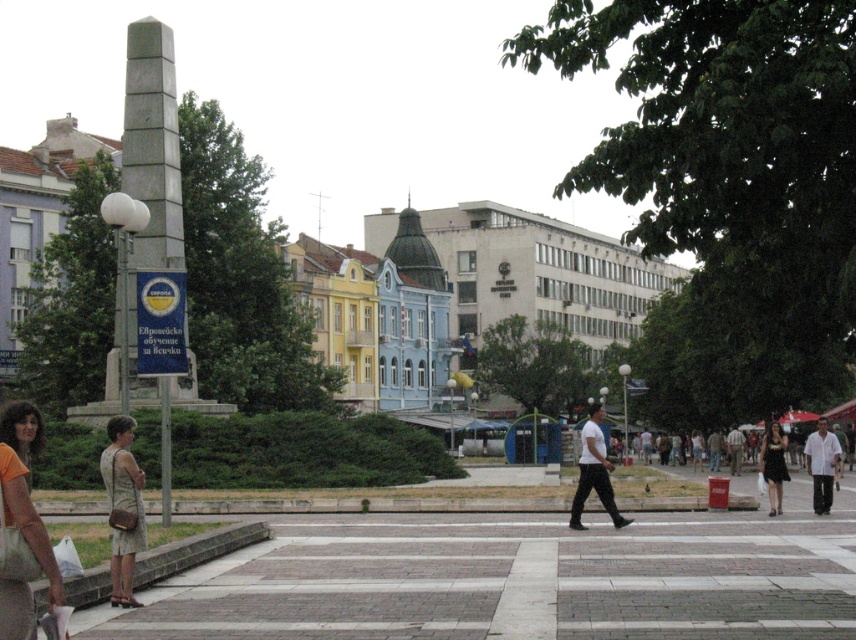
You are a fashion designer observing two dresses in an urban setting. The beige textured dress at lower left and the black dress at lower right are part of your inspiration. Which dress is taller in height?

The beige textured dress at lower left is taller than the black dress at lower right according to the description.

You are a delivery robot that is 2 feet wide. You need to move from the beige textured dress at lower left to the black dress at lower right. Can you navigate the path between them without any obstacles?

The beige textured dress at lower left and black dress at lower right are 62.29 feet apart from each other. Since the distance is more than sufficient for a 2 feet wide robot, yes, the robot can navigate the path between them without any obstacles.